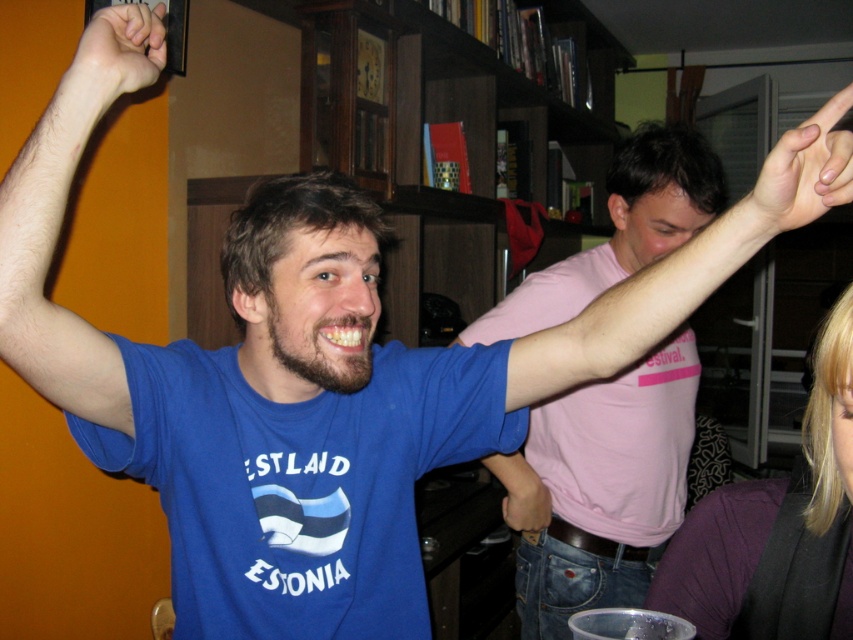
Can you confirm if hairless skin at upper left is taller than matte blue shirt at upper center?

Yes, hairless skin at upper left is taller than matte blue shirt at upper center.

Can you confirm if hairless skin at upper left is positioned below matte blue shirt at upper center?

No, hairless skin at upper left is not below matte blue shirt at upper center.

Image resolution: width=853 pixels, height=640 pixels. What are the coordinates of `hairless skin at upper left` in the screenshot? It's located at (62, 220).

Is point (515, 509) positioned behind point (811, 109)?

No, it is not.

Who is more distant from viewer, (519, 465) or (828, 220)?

The point (828, 220) is behind.

You are a GUI agent. You are given a task and a screenshot of the screen. Output one action in this format:
    pyautogui.click(x=<x>, y=<y>)
    Task: Click on the matte blue shirt at upper center
    
    Given the screenshot: What is the action you would take?
    pyautogui.click(x=525, y=499)

Between point (804, 497) and point (161, 28), which one is positioned behind?

Positioned behind is point (804, 497).

Is dark purple fabric at lower right below smooth skin fist at upper left?

Correct, dark purple fabric at lower right is located below smooth skin fist at upper left.

Locate an element on the screen. dark purple fabric at lower right is located at coordinates (776, 525).